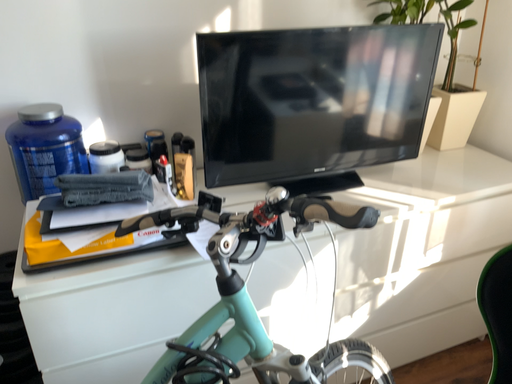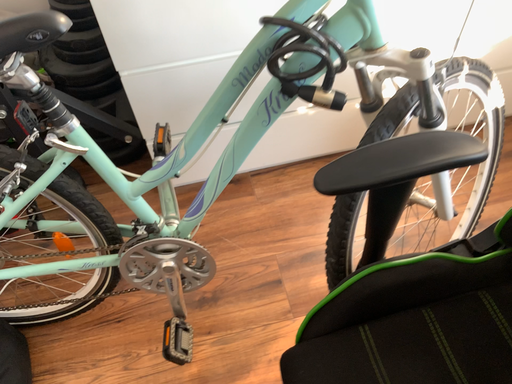
Question: How did the camera likely rotate when shooting the video?

Choices:
 (A) rotated right
 (B) rotated left

Answer: (B)